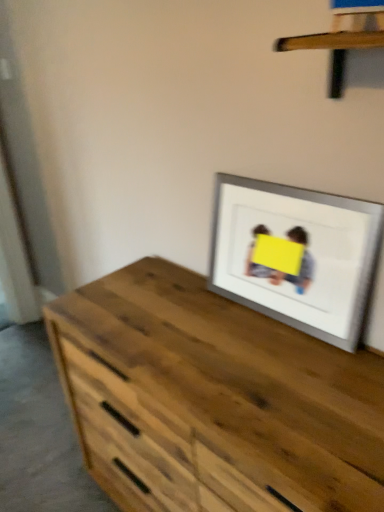
Measure the distance between point (357, 28) and camera.

Point (357, 28) is 29.17 inches away from camera.

Where is `wooden chest of drawers at center`? Image resolution: width=384 pixels, height=512 pixels. wooden chest of drawers at center is located at coordinates (213, 400).

At what (x,y) coordinates should I click in order to perform the action: click on wooden at upper center. Please return your answer as a coordinate pair (x, y). Image resolution: width=384 pixels, height=512 pixels. Looking at the image, I should click on (343, 37).

Is silver/metallic picture frame at upper right at the right side of wooden at upper center?

In fact, silver/metallic picture frame at upper right is to the left of wooden at upper center.

Who is shorter, silver/metallic picture frame at upper right or wooden at upper center?

With less height is wooden at upper center.

Is the position of silver/metallic picture frame at upper right less distant than that of wooden at upper center?

No, it is not.

From the picture: Can you confirm if wooden chest of drawers at center is shorter than silver/metallic picture frame at upper right?

No.

Consider the image. Is wooden chest of drawers at center smaller than silver/metallic picture frame at upper right?

Actually, wooden chest of drawers at center might be larger than silver/metallic picture frame at upper right.

In the image, is wooden chest of drawers at center on the left side or the right side of silver/metallic picture frame at upper right?

In the image, wooden chest of drawers at center appears on the left side of silver/metallic picture frame at upper right.

Choose the correct answer: Is wooden at upper center inside wooden chest of drawers at center or outside it?

The correct answer is: outside.

Is wooden at upper center facing towards wooden chest of drawers at center?

No, wooden at upper center is not aimed at wooden chest of drawers at center.

Which object is positioned more to the left, wooden at upper center or wooden chest of drawers at center?

From the viewer's perspective, wooden chest of drawers at center appears more on the left side.

How far apart are silver/metallic picture frame at upper right and wooden chest of drawers at center?

They are 10.10 inches apart.

Is silver/metallic picture frame at upper right far from wooden chest of drawers at center?

They are positioned close to each other.

From a real-world perspective, between silver/metallic picture frame at upper right and wooden chest of drawers at center, who is vertically lower?

From a 3D spatial view, wooden chest of drawers at center is below.

Between silver/metallic picture frame at upper right and wooden chest of drawers at center, which one appears on the right side from the viewer's perspective?

silver/metallic picture frame at upper right is more to the right.

Which is in front, point (159, 444) or point (370, 8)?

Positioned in front is point (370, 8).

Does wooden chest of drawers at center have a greater height compared to wooden at upper center?

Correct, wooden chest of drawers at center is much taller as wooden at upper center.

What's the angular difference between wooden chest of drawers at center and wooden at upper center's facing directions?

The angle between the facing direction of wooden chest of drawers at center and the facing direction of wooden at upper center is 0.207 degrees.

Looking at their sizes, would you say wooden at upper center is wider or thinner than silver/metallic picture frame at upper right?

In the image, wooden at upper center appears to be wider than silver/metallic picture frame at upper right.

Is wooden at upper center turned away from silver/metallic picture frame at upper right?

No, wooden at upper center is not facing the opposite direction of silver/metallic picture frame at upper right.

From a real-world perspective, is wooden at upper center on top of silver/metallic picture frame at upper right?

Yes.

Which object is positioned more to the left, wooden at upper center or silver/metallic picture frame at upper right?

silver/metallic picture frame at upper right.

In order to click on picture frame that is under the wooden at upper center (from a real-world perspective) in this screenshot , I will do `click(296, 255)`.

The width and height of the screenshot is (384, 512). Find the location of `picture frame above the wooden chest of drawers at center (from the image's perspective)`. picture frame above the wooden chest of drawers at center (from the image's perspective) is located at coordinates (296, 255).

Looking at the image, which one is located closer to wooden chest of drawers at center, wooden at upper center or silver/metallic picture frame at upper right?

The object closer to wooden chest of drawers at center is silver/metallic picture frame at upper right.

Looking at the image, which one is located closer to silver/metallic picture frame at upper right, wooden at upper center or wooden chest of drawers at center?

wooden chest of drawers at center lies closer to silver/metallic picture frame at upper right than the other object.

When comparing their distances from wooden at upper center, does silver/metallic picture frame at upper right or wooden chest of drawers at center seem closer?

The object closer to wooden at upper center is silver/metallic picture frame at upper right.

From the image, which object appears to be farther from wooden at upper center, wooden chest of drawers at center or silver/metallic picture frame at upper right?

Among the two, wooden chest of drawers at center is located further to wooden at upper center.

Estimate the real-world distances between objects in this image. Which object is closer to wooden chest of drawers at center, silver/metallic picture frame at upper right or wooden at upper center?

The object closer to wooden chest of drawers at center is silver/metallic picture frame at upper right.

Looking at the image, which one is located further to silver/metallic picture frame at upper right, wooden chest of drawers at center or wooden at upper center?

The object further to silver/metallic picture frame at upper right is wooden at upper center.

Find the location of `picture frame between wooden at upper center and wooden chest of drawers at center from top to bottom`. picture frame between wooden at upper center and wooden chest of drawers at center from top to bottom is located at coordinates (296, 255).